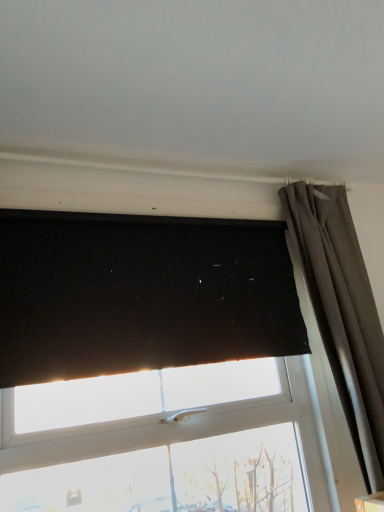
Measure the distance between point (192, 304) and camera.

A distance of 5.11 feet exists between point (192, 304) and camera.

What do you see at coordinates (153, 367) in the screenshot?
I see `black matte blind at upper center` at bounding box center [153, 367].

Where is `black matte blind at upper center`? The width and height of the screenshot is (384, 512). black matte blind at upper center is located at coordinates 153,367.

What do you see at coordinates (343, 313) in the screenshot? The width and height of the screenshot is (384, 512). I see `dark gray textured curtain at upper right` at bounding box center [343, 313].

Identify the location of dark gray textured curtain at upper right. This screenshot has width=384, height=512. (343, 313).

The image size is (384, 512). What are the coordinates of `black matte blind at upper center` in the screenshot? It's located at (153, 367).

Can you confirm if black matte blind at upper center is positioned to the right of dark gray textured curtain at upper right?

In fact, black matte blind at upper center is to the left of dark gray textured curtain at upper right.

Is black matte blind at upper center in front of or behind dark gray textured curtain at upper right in the image?

black matte blind at upper center is in front of dark gray textured curtain at upper right.

Does point (198, 391) appear closer or farther from the camera than point (368, 361)?

Point (198, 391) is positioned closer to the camera compared to point (368, 361).

From the image's perspective, which one is positioned higher, black matte blind at upper center or dark gray textured curtain at upper right?

black matte blind at upper center.

From a real-world perspective, is black matte blind at upper center located beneath dark gray textured curtain at upper right?

No, from a real-world perspective, black matte blind at upper center is not beneath dark gray textured curtain at upper right.

Does black matte blind at upper center have a lesser width compared to dark gray textured curtain at upper right?

Yes.

Is black matte blind at upper center taller than dark gray textured curtain at upper right?

No.

Based on the photo, considering the sizes of objects black matte blind at upper center and dark gray textured curtain at upper right in the image provided, who is bigger, black matte blind at upper center or dark gray textured curtain at upper right?

With larger size is dark gray textured curtain at upper right.

Can dark gray textured curtain at upper right be found inside black matte blind at upper center?

No, dark gray textured curtain at upper right is not a part of black matte blind at upper center.

Are black matte blind at upper center and dark gray textured curtain at upper right located far from each other?

Actually, black matte blind at upper center and dark gray textured curtain at upper right are a little close together.

Is black matte blind at upper center looking in the opposite direction of dark gray textured curtain at upper right?

No, black matte blind at upper center is not facing away from dark gray textured curtain at upper right.

Where is `curtain on the right of black matte blind at upper center`? The image size is (384, 512). curtain on the right of black matte blind at upper center is located at coordinates (343, 313).

Between dark gray textured curtain at upper right and black matte blind at upper center, which one appears on the left side from the viewer's perspective?

black matte blind at upper center is more to the left.

Who is more distant, dark gray textured curtain at upper right or black matte blind at upper center?

dark gray textured curtain at upper right is more distant.

Is point (296, 193) in front of point (152, 404)?

No, (296, 193) is behind (152, 404).

In the scene shown: From the image's perspective, which is above, dark gray textured curtain at upper right or black matte blind at upper center?

black matte blind at upper center.

From a real-world perspective, is dark gray textured curtain at upper right above or below black matte blind at upper center?

dark gray textured curtain at upper right is situated lower than black matte blind at upper center in the real world.

Which of these two, dark gray textured curtain at upper right or black matte blind at upper center, is wider?

Wider between the two is dark gray textured curtain at upper right.

Between dark gray textured curtain at upper right and black matte blind at upper center, which one has more height?

dark gray textured curtain at upper right is taller.

Based on their sizes in the image, would you say dark gray textured curtain at upper right is bigger or smaller than black matte blind at upper center?

dark gray textured curtain at upper right is bigger than black matte blind at upper center.

Could black matte blind at upper center be considered to be inside dark gray textured curtain at upper right?

No, black matte blind at upper center is not surrounded by dark gray textured curtain at upper right.

Is the surface of dark gray textured curtain at upper right in direct contact with black matte blind at upper center?

dark gray textured curtain at upper right and black matte blind at upper center are clearly separated.

Is dark gray textured curtain at upper right oriented away from black matte blind at upper center?

dark gray textured curtain at upper right is not turned away from black matte blind at upper center.

How far apart are dark gray textured curtain at upper right and black matte blind at upper center?

19.55 inches.

Image resolution: width=384 pixels, height=512 pixels. Identify the location of curtain behind the black matte blind at upper center. (343, 313).

Locate an element on the screen. This screenshot has height=512, width=384. curtain on the right of black matte blind at upper center is located at coordinates (343, 313).

This screenshot has height=512, width=384. Find the location of `window located above the dark gray textured curtain at upper right (from a real-world perspective)`. window located above the dark gray textured curtain at upper right (from a real-world perspective) is located at coordinates (153, 367).